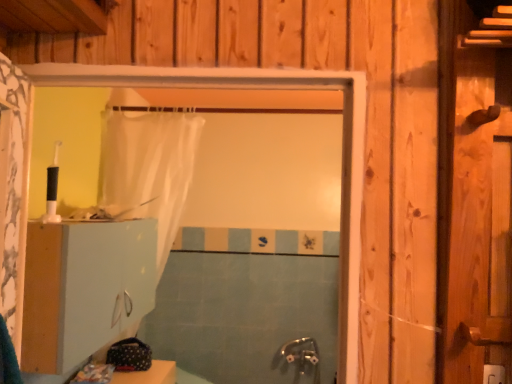
Question: Based on their positions, is translucent white shower curtain at center located to the left or right of blue tile bath at center?

Choices:
 (A) right
 (B) left

Answer: (B)

Question: Considering the positions of translucent white shower curtain at center and blue tile bath at center in the image, is translucent white shower curtain at center bigger or smaller than blue tile bath at center?

Choices:
 (A) small
 (B) big

Answer: (B)

Question: Considering the real-world distances, which object is closest to the white matte cabinet at lower left?

Choices:
 (A) translucent white shower curtain at center
 (B) blue tile bath at center

Answer: (A)

Question: Which is farther from the white matte cabinet at lower left?

Choices:
 (A) translucent white shower curtain at center
 (B) blue tile bath at center

Answer: (B)